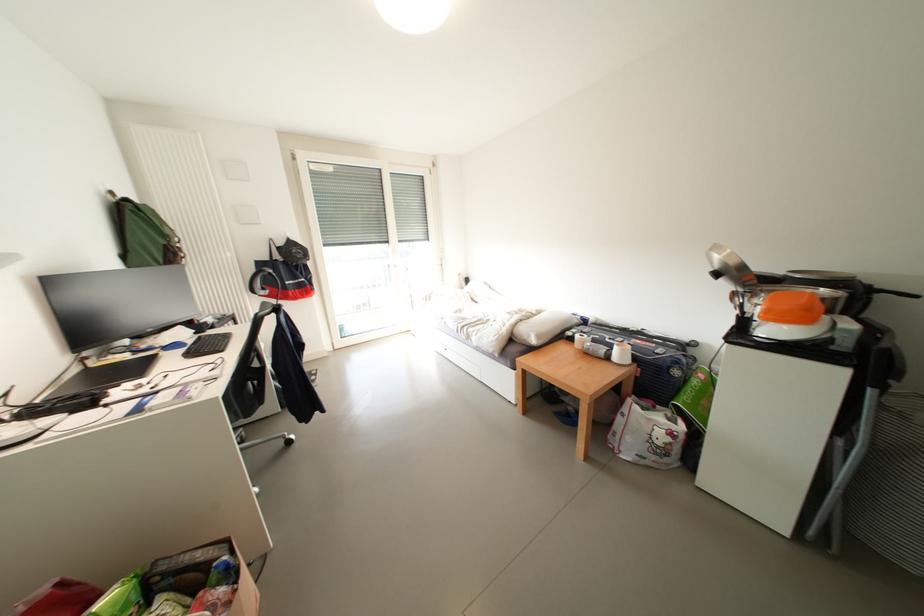
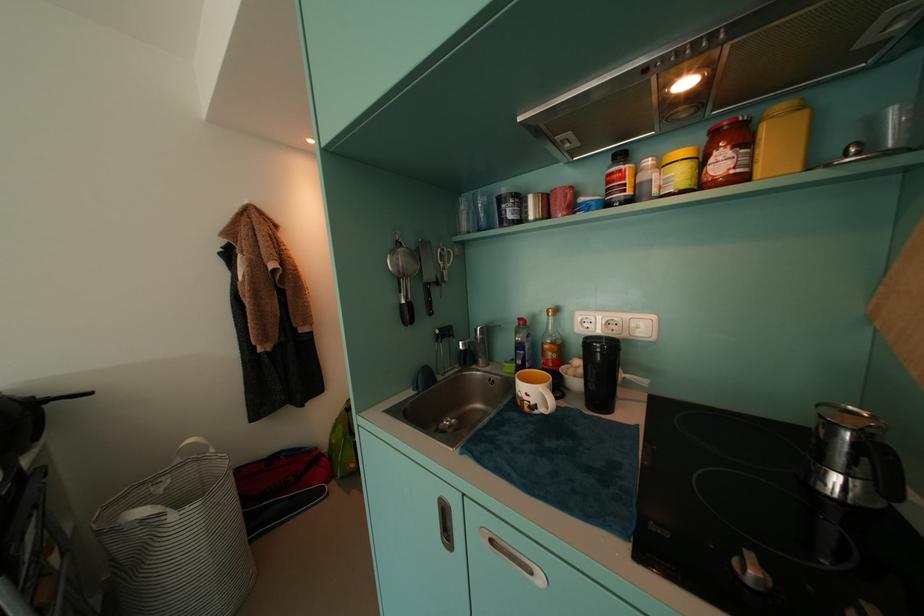
Question: The camera is either moving clockwise (left) or counter-clockwise (right) around the object. The first image is from the beginning of the video and the second image is from the end. Is the camera moving left or right when shooting the video?

Choices:
 (A) Left
 (B) Right

Answer: (A)